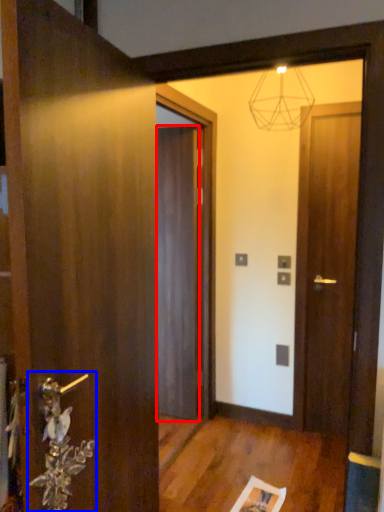
Question: Among these objects, which one is nearest to the camera, door (highlighted by a red box) or door handle (highlighted by a blue box)?

Choices:
 (A) door
 (B) door handle

Answer: (B)